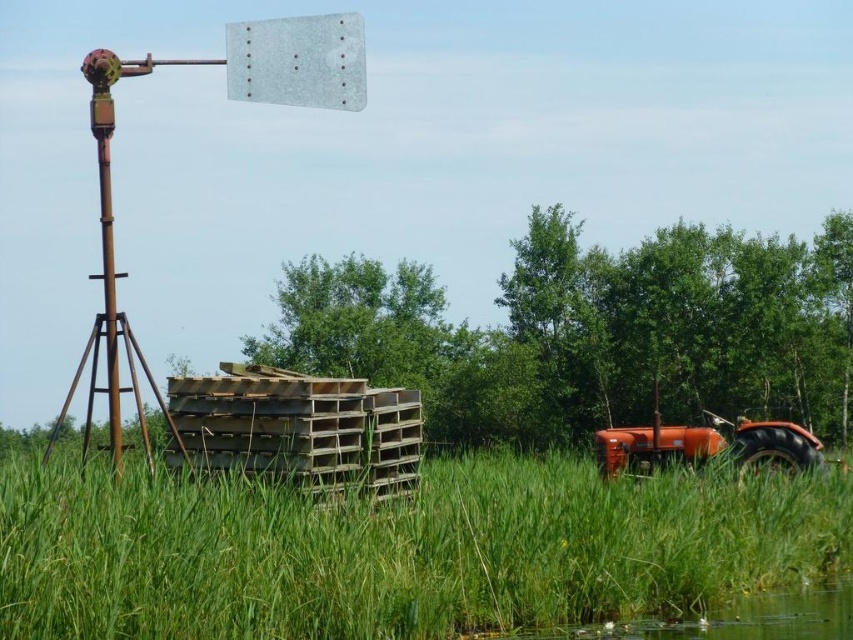
You are standing in the rural scene and want to place a small decoration between the two points, point (746, 493) and point (738, 451). Which point should the decoration be closer to in order to appear closer to you?

The decoration should be placed closer to point (746, 493) because it is closer to the viewer than point (738, 451).